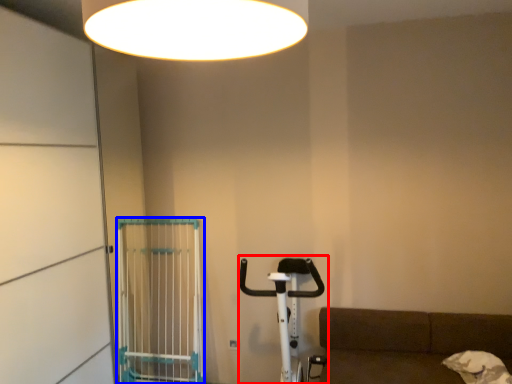
Question: Which point is further to the camera, baby carriage (highlighted by a red box) or cage (highlighted by a blue box)?

Choices:
 (A) baby carriage
 (B) cage

Answer: (B)